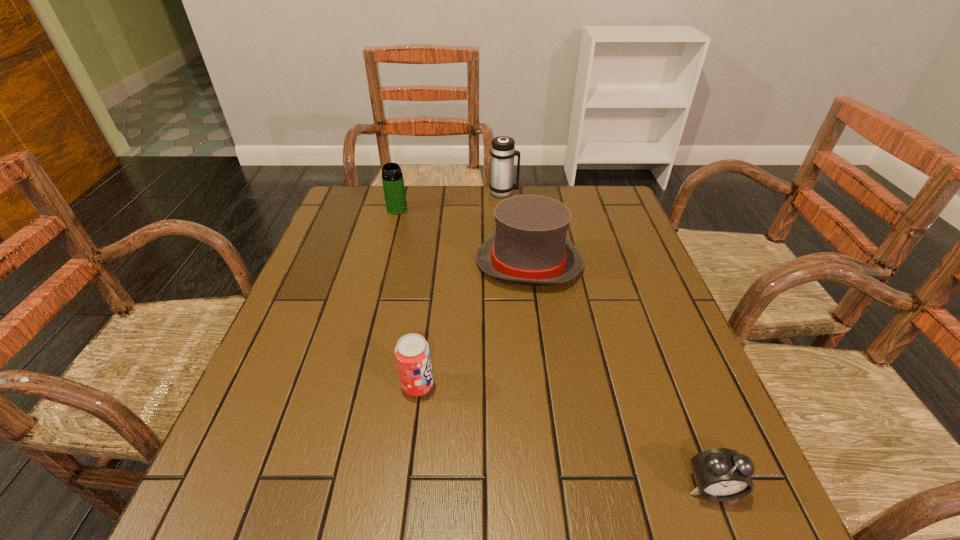
Find the location of a particular element. The width and height of the screenshot is (960, 540). vacant space at the left edge is located at coordinates (324, 406).

Where is `free spot at the right edge of the desktop`? Image resolution: width=960 pixels, height=540 pixels. free spot at the right edge of the desktop is located at coordinates (607, 279).

Identify the location of vacant space at the far right corner. (597, 227).

The width and height of the screenshot is (960, 540). Identify the location of blank space at the near right corner. (751, 500).

This screenshot has width=960, height=540. Find the location of `free space that is in between the second farthest object and the dress hat`. free space that is in between the second farthest object and the dress hat is located at coordinates (463, 237).

At what (x,y) coordinates should I click in order to perform the action: click on free space that is in between the dress hat and the rightmost object. Please return your answer as a coordinate pair (x, y). The width and height of the screenshot is (960, 540). Looking at the image, I should click on (620, 376).

Where is `free space between the alarm clock and the dress hat`? The image size is (960, 540). free space between the alarm clock and the dress hat is located at coordinates (620, 376).

The image size is (960, 540). What are the coordinates of `free spot between the third farthest object and the rightmost object` in the screenshot? It's located at (620, 376).

Where is `free space between the right thermos bottle and the leftmost object`? Image resolution: width=960 pixels, height=540 pixels. free space between the right thermos bottle and the leftmost object is located at coordinates pyautogui.click(x=450, y=201).

Where is `vacant area that lies between the soda can and the dress hat`? The height and width of the screenshot is (540, 960). vacant area that lies between the soda can and the dress hat is located at coordinates (473, 325).